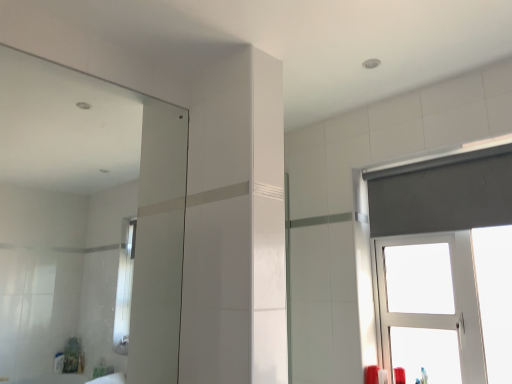
This screenshot has width=512, height=384. What do you see at coordinates (399, 375) in the screenshot?
I see `matte red candle at lower right, acting as the 2th toiletry starting from the left` at bounding box center [399, 375].

Describe the element at coordinates (442, 193) in the screenshot. I see `white plastic window at upper right` at that location.

The image size is (512, 384). I want to click on matte red candle at lower right, which is the first toiletry in right-to-left order, so click(399, 375).

What's the angular difference between white plastic window at upper right and matte red candle at lower right, which is the first toiletry in right-to-left order,'s facing directions?

They differ by 90.1 degrees in their facing directions.

Identify the location of window lying above the matte red candle at lower right, acting as the 2th toiletry starting from the left (from the image's perspective). pyautogui.click(x=442, y=193).

Which point is more forward, (397, 179) or (397, 382)?

The point (397, 382) is closer.

From a real-world perspective, who is located higher, white plastic window at upper right or matte red candle at lower right, acting as the 2th toiletry starting from the left?

In real-world perspective, white plastic window at upper right is above.

Between point (398, 379) and point (384, 370), which one is positioned in front?

The point (398, 379) is closer.

Where is `toiletry that appears on the left of matte red candle at lower right, which is the first toiletry in right-to-left order`? The height and width of the screenshot is (384, 512). toiletry that appears on the left of matte red candle at lower right, which is the first toiletry in right-to-left order is located at coordinates (382, 376).

Can you confirm if matte red candle at lower right, acting as the 2th toiletry starting from the left, is wider than matte plastic toothbrush at lower right, the 2th toiletry viewed from the right?

No.

From a real-world perspective, which is physically below, matte red candle at lower right, which is the first toiletry in right-to-left order, or matte plastic toothbrush at lower right, the first toiletry in the left-to-right sequence?

matte plastic toothbrush at lower right, the first toiletry in the left-to-right sequence.

In the image, there is a clear glass mirror at upper left. Identify the location of window below it (from the image's perspective). Image resolution: width=512 pixels, height=384 pixels. (442, 193).

How different are the orientations of clear glass mirror at upper left and white plastic window at upper right in degrees?

The facing directions of clear glass mirror at upper left and white plastic window at upper right are 90.6 degrees apart.

Looking at this image, would you say clear glass mirror at upper left is outside white plastic window at upper right?

That's correct, clear glass mirror at upper left is outside of white plastic window at upper right.

From the image's perspective, is clear glass mirror at upper left above white plastic window at upper right?

Yes.

Between matte red candle at lower right, acting as the 2th toiletry starting from the left, and clear glass mirror at upper left, which one has larger size?

clear glass mirror at upper left.

Is matte red candle at lower right, which is the first toiletry in right-to-left order, thinner than clear glass mirror at upper left?

Incorrect, the width of matte red candle at lower right, which is the first toiletry in right-to-left order, is not less than that of clear glass mirror at upper left.

Which point is more forward, [93,101] or [379,379]?

The point [379,379] is more forward.

Who is shorter, clear glass mirror at upper left or matte plastic toothbrush at lower right, the first toiletry in the left-to-right sequence?

Standing shorter between the two is matte plastic toothbrush at lower right, the first toiletry in the left-to-right sequence.

Is clear glass mirror at upper left looking in the opposite direction of matte plastic toothbrush at lower right, the 2th toiletry viewed from the right?

That's not correct — clear glass mirror at upper left is not looking away from matte plastic toothbrush at lower right, the 2th toiletry viewed from the right.

Is clear glass mirror at upper left outside of matte plastic toothbrush at lower right, the 2th toiletry viewed from the right?

Yes, clear glass mirror at upper left is not within matte plastic toothbrush at lower right, the 2th toiletry viewed from the right.

From a real-world perspective, is matte plastic toothbrush at lower right, the 2th toiletry viewed from the right, located higher than white plastic window at upper right?

Actually, matte plastic toothbrush at lower right, the 2th toiletry viewed from the right, is physically below white plastic window at upper right in the real world.

Considering the sizes of matte plastic toothbrush at lower right, the 2th toiletry viewed from the right, and white plastic window at upper right in the image, is matte plastic toothbrush at lower right, the 2th toiletry viewed from the right, wider or thinner than white plastic window at upper right?

In the image, matte plastic toothbrush at lower right, the 2th toiletry viewed from the right, appears to be more narrow than white plastic window at upper right.

The image size is (512, 384). What are the coordinates of `window that is on the right side of matte plastic toothbrush at lower right, the first toiletry in the left-to-right sequence` in the screenshot? It's located at (442, 193).

Which point is more forward, [387,380] or [475,198]?

Point [475,198]

Based on the photo, which is closer, (396, 368) or (390, 232)?

Point (396, 368) is closer to the camera than point (390, 232).

Are matte red candle at lower right, acting as the 2th toiletry starting from the left, and white plastic window at upper right located far from each other?

No, there isn't a large distance between matte red candle at lower right, acting as the 2th toiletry starting from the left, and white plastic window at upper right.

Considering the sizes of matte red candle at lower right, which is the first toiletry in right-to-left order, and white plastic window at upper right in the image, is matte red candle at lower right, which is the first toiletry in right-to-left order, wider or thinner than white plastic window at upper right?

Clearly, matte red candle at lower right, which is the first toiletry in right-to-left order, has less width compared to white plastic window at upper right.

Does matte red candle at lower right, acting as the 2th toiletry starting from the left, have a lesser height compared to white plastic window at upper right?

Yes, matte red candle at lower right, acting as the 2th toiletry starting from the left, is shorter than white plastic window at upper right.

I want to click on window above the matte red candle at lower right, acting as the 2th toiletry starting from the left (from a real-world perspective), so click(442, 193).

The image size is (512, 384). Identify the location of toiletry located below the matte red candle at lower right, acting as the 2th toiletry starting from the left (from the image's perspective). (382, 376).

When comparing their distances from matte red candle at lower right, acting as the 2th toiletry starting from the left, does white plastic window at upper right or matte plastic toothbrush at lower right, the first toiletry in the left-to-right sequence, seem closer?

Based on the image, matte plastic toothbrush at lower right, the first toiletry in the left-to-right sequence, appears to be nearer to matte red candle at lower right, acting as the 2th toiletry starting from the left.

When comparing their distances from matte red candle at lower right, acting as the 2th toiletry starting from the left, does matte plastic toothbrush at lower right, the 2th toiletry viewed from the right, or clear glass mirror at upper left seem further?

clear glass mirror at upper left.

Estimate the real-world distances between objects in this image. Which object is further from matte plastic toothbrush at lower right, the 2th toiletry viewed from the right, matte red candle at lower right, which is the first toiletry in right-to-left order, or white plastic window at upper right?

The object further to matte plastic toothbrush at lower right, the 2th toiletry viewed from the right, is white plastic window at upper right.

Looking at the image, which one is located closer to white plastic window at upper right, matte red candle at lower right, acting as the 2th toiletry starting from the left, or matte plastic toothbrush at lower right, the 2th toiletry viewed from the right?

matte red candle at lower right, acting as the 2th toiletry starting from the left, is positioned closer to the anchor white plastic window at upper right.

When comparing their distances from clear glass mirror at upper left, does matte plastic toothbrush at lower right, the 2th toiletry viewed from the right, or matte red candle at lower right, which is the first toiletry in right-to-left order, seem closer?

Based on the image, matte plastic toothbrush at lower right, the 2th toiletry viewed from the right, appears to be nearer to clear glass mirror at upper left.

Looking at the image, which one is located further to matte plastic toothbrush at lower right, the first toiletry in the left-to-right sequence, white plastic window at upper right or clear glass mirror at upper left?

Among the two, clear glass mirror at upper left is located further to matte plastic toothbrush at lower right, the first toiletry in the left-to-right sequence.

Looking at the image, which one is located further to clear glass mirror at upper left, matte red candle at lower right, acting as the 2th toiletry starting from the left, or white plastic window at upper right?

matte red candle at lower right, acting as the 2th toiletry starting from the left, is further to clear glass mirror at upper left.

Based on the photo, looking at the image, which one is located further to white plastic window at upper right, matte red candle at lower right, acting as the 2th toiletry starting from the left, or clear glass mirror at upper left?

clear glass mirror at upper left lies further to white plastic window at upper right than the other object.

The height and width of the screenshot is (384, 512). In order to click on toiletry between white plastic window at upper right and matte plastic toothbrush at lower right, the 2th toiletry viewed from the right, from top to bottom in this screenshot , I will do `click(399, 375)`.

The width and height of the screenshot is (512, 384). I want to click on toiletry between clear glass mirror at upper left and matte red candle at lower right, which is the first toiletry in right-to-left order, so click(382, 376).